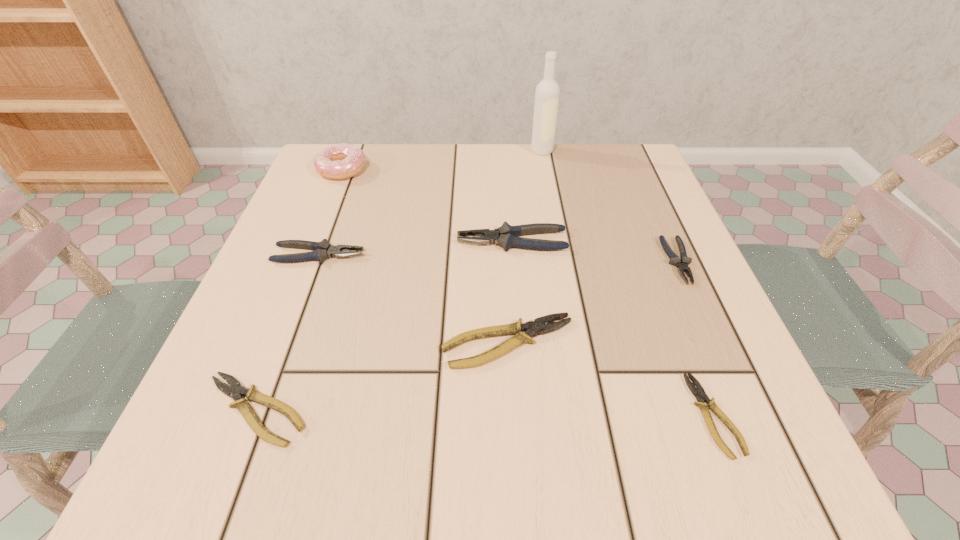
Point out which gray pliers is positioned as the third nearest to the leftmost yellow pliers. Please provide its 2D coordinates. Your answer should be formatted as a tuple, i.e. [(x, y)], where the tuple contains the x and y coordinates of a point satisfying the conditions above.

[(682, 263)]

Identify which yellow pliers is located as the nearest to the smallest yellow pliers. Please provide its 2D coordinates. Your answer should be formatted as a tuple, i.e. [(x, y)], where the tuple contains the x and y coordinates of a point satisfying the conditions above.

[(532, 328)]

The width and height of the screenshot is (960, 540). I want to click on yellow pliers that is the nearest to the fifth shortest pliers, so click(532, 328).

Image resolution: width=960 pixels, height=540 pixels. I want to click on free location that satisfies the following two spatial constraints: 1. at the gripping part of the third nearest pliers; 2. on the right side of the fifth shortest pliers, so click(287, 343).

Locate an element on the screen. The image size is (960, 540). free space that satisfies the following two spatial constraints: 1. at the gripping part of the smallest yellow pliers; 2. on the left side of the second gray pliers from right to left is located at coordinates (525, 415).

At what (x,y) coordinates should I click in order to perform the action: click on free location that satisfies the following two spatial constraints: 1. on the back side of the shortest object; 2. at the gripping part of the fifth shortest object. Please return your answer as a coordinate pair (x, y). Looking at the image, I should click on (651, 255).